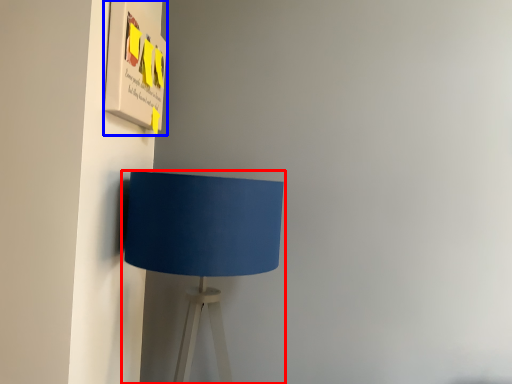
Question: Which point is closer to the camera, lamp (highlighted by a red box) or poster (highlighted by a blue box)?

Choices:
 (A) lamp
 (B) poster

Answer: (A)